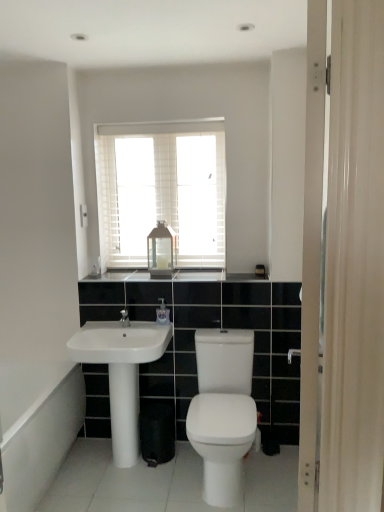
This screenshot has width=384, height=512. I want to click on blank area to the left of white glossy bidet at center, so click(x=142, y=483).